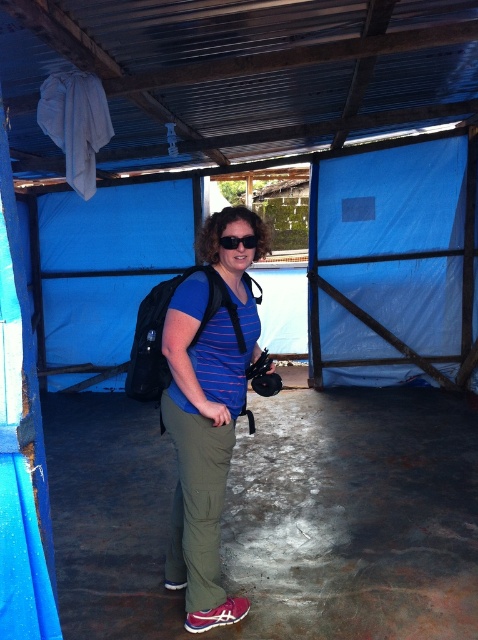
You are a photographer trying to position your equipment properly. You have a matte blue shirt at center and a black matte sunglasses at center. Which object is positioned to the left when viewed from your perspective?

The matte blue shirt at center is to the left of the black matte sunglasses at center.